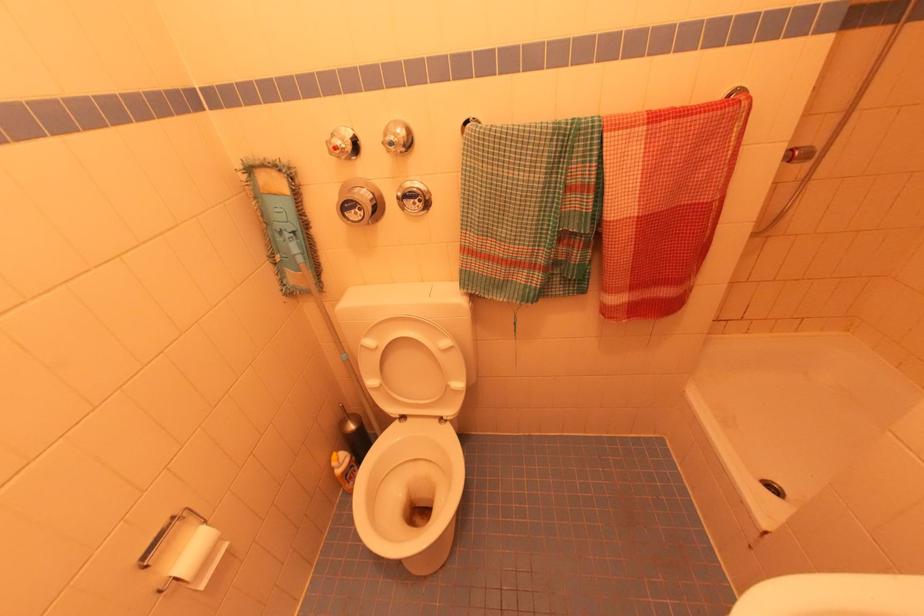
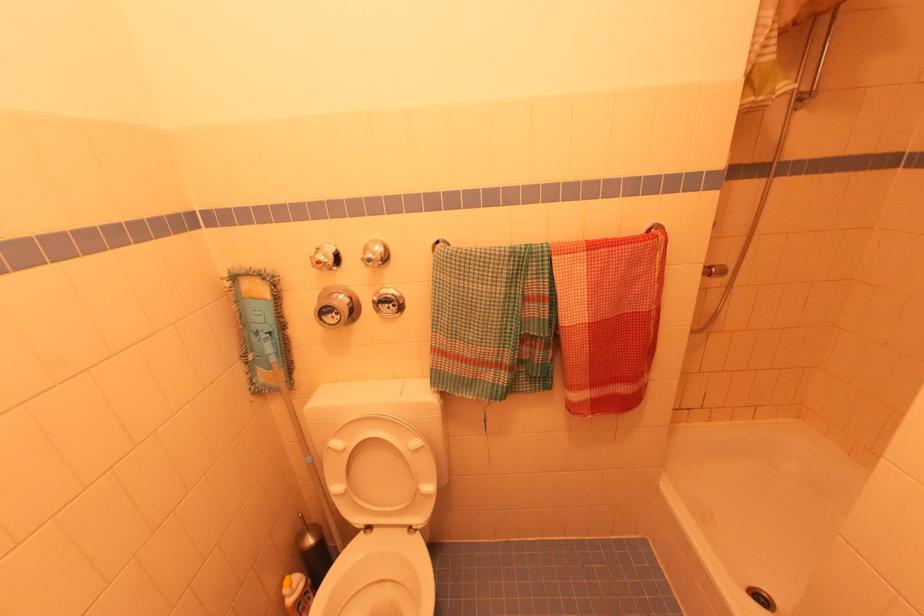
Find the pixel in the second image that matches pixel 355 212 in the first image.

(332, 315)